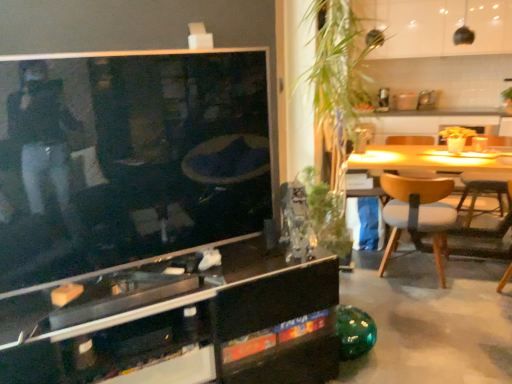
Question: From a real-world perspective, is green leafy plant at center, which is the first plant in top-to-bottom order, positioned above or below wooden chair at right, which ranks as the second chair in left-to-right order?

Choices:
 (A) below
 (B) above

Answer: (B)

Question: In terms of width, does green leafy plant at center, which is the 2th plant in bottom-to-top order, look wider or thinner when compared to wooden chair at right, marked as the 1th chair in a right-to-left arrangement?

Choices:
 (A) thin
 (B) wide

Answer: (B)

Question: Which of these objects is positioned closest to the wooden chair at right, marked as the 1th chair in a right-to-left arrangement?

Choices:
 (A) light brown wood chair at right, placed as the first chair when sorted from left to right
 (B) green glass vase at center, marked as the 2th plant in a top-to-bottom arrangement
 (C) black glass cabinet at center
 (D) green leafy plant at center, which is the 2th plant in bottom-to-top order

Answer: (A)

Question: Based on their relative distances, which object is nearer to the wooden chair at right, which ranks as the second chair in left-to-right order?

Choices:
 (A) green leafy plant at center, which is the first plant in top-to-bottom order
 (B) black glass cabinet at center
 (C) light brown wood chair at right, acting as the 2th chair starting from the right
 (D) green glass vase at center, marked as the 2th plant in a top-to-bottom arrangement

Answer: (C)